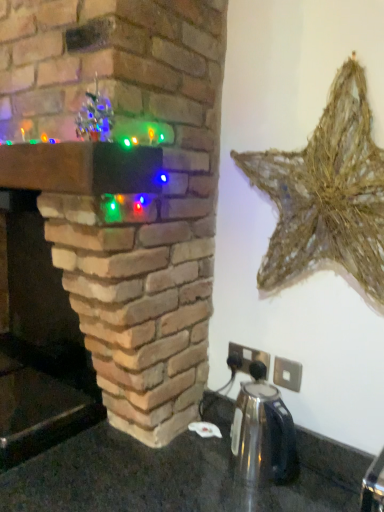
Question: Relative to brick fireplace at center, is shiny metallic kettle at center in front or behind?

Choices:
 (A) behind
 (B) front

Answer: (A)

Question: From the image's perspective, is shiny metallic kettle at center located above or below brick fireplace at center?

Choices:
 (A) below
 (B) above

Answer: (A)

Question: Estimate the real-world distances between objects in this image. Which object is closer to the rustic straw star at upper right?

Choices:
 (A) brick fireplace at center
 (B) shiny metallic kettle at center

Answer: (A)

Question: Based on their relative distances, which object is nearer to the shiny metallic kettle at center?

Choices:
 (A) rustic straw star at upper right
 (B) brick fireplace at center

Answer: (A)